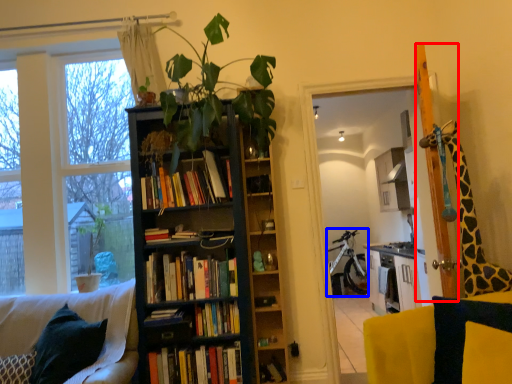
Question: Which point is closer to the camera, screen door (highlighted by a red box) or bicycle (highlighted by a blue box)?

Choices:
 (A) screen door
 (B) bicycle

Answer: (A)